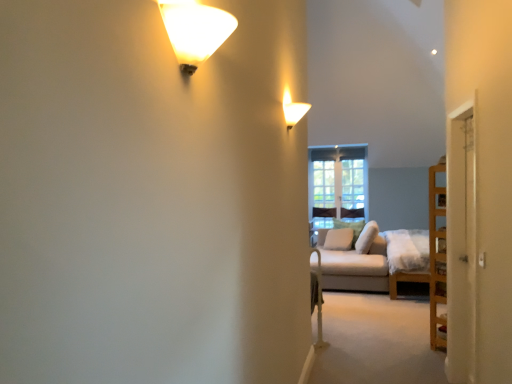
Question: From the image's perspective, relative to matte white wall sconce at upper center, which is counted as the second lamp, starting from the front, is clear glass window at center above or below?

Choices:
 (A) above
 (B) below

Answer: (B)

Question: Is clear glass window at center inside the boundaries of matte white wall sconce at upper center, placed as the first lamp when sorted from back to front, or outside?

Choices:
 (A) inside
 (B) outside

Answer: (B)

Question: Estimate the real-world distances between objects in this image. Which object is farther from the white fabric pillow at center, which is counted as the third pillow, starting from the back?

Choices:
 (A) matte white wall sconce at upper center, which is counted as the second lamp, starting from the front
 (B) white soft pillow at center, the 2th pillow when ordered from front to back
 (C) clear glass window at center
 (D) matte glass lamp at upper left, positioned as the first lamp in left-to-right order
 (E) white wooden door at right

Answer: (D)

Question: Which object is positioned farthest from the clear glass window at center?

Choices:
 (A) matte white wall sconce at upper center, placed as the 2th lamp when sorted from left to right
 (B) white fabric couch at right
 (C) white wooden door at right
 (D) white soft pillow at center, the first pillow viewed from the back
 (E) white fabric pillow at center, the first pillow positioned from the front

Answer: (C)